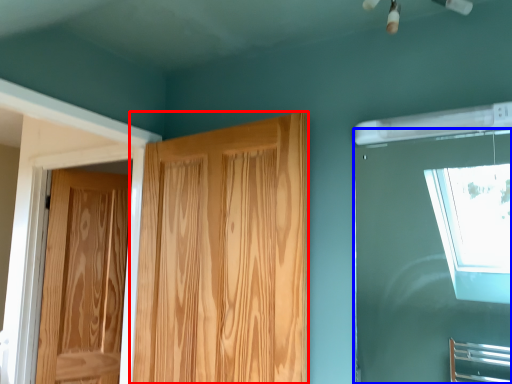
Question: Among these objects, which one is farthest to the camera, door (highlighted by a red box) or window (highlighted by a blue box)?

Choices:
 (A) door
 (B) window

Answer: (A)